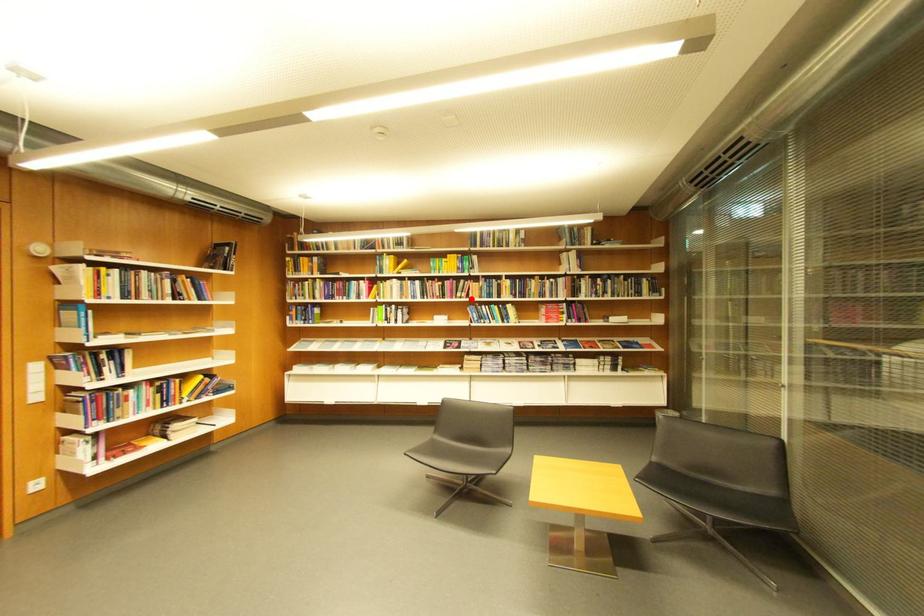
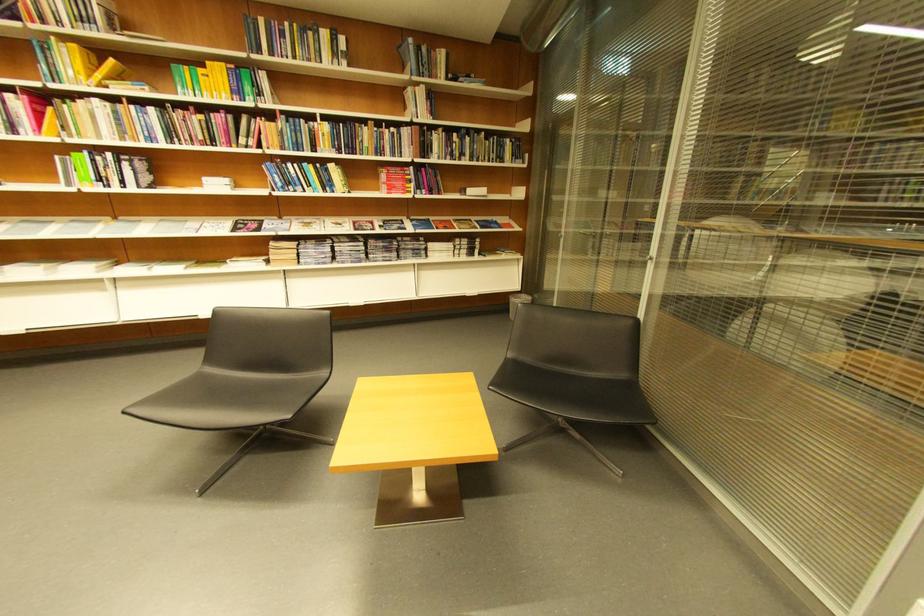
Locate, in the second image, the point that corresponds to the highlighted location in the first image.

(258, 148)